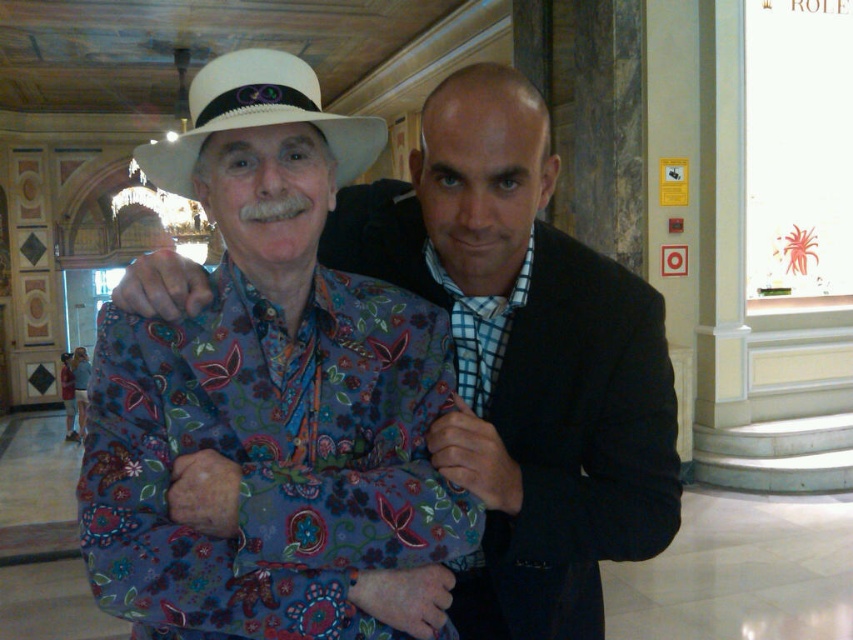
Locate an element on the screen. This screenshot has width=853, height=640. floral fabric shirt at center is located at coordinates (523, 364).

Image resolution: width=853 pixels, height=640 pixels. What do you see at coordinates (523, 364) in the screenshot?
I see `floral fabric shirt at center` at bounding box center [523, 364].

Describe the element at coordinates (523, 364) in the screenshot. I see `floral fabric shirt at center` at that location.

Locate an element on the screen. floral fabric shirt at center is located at coordinates (523, 364).